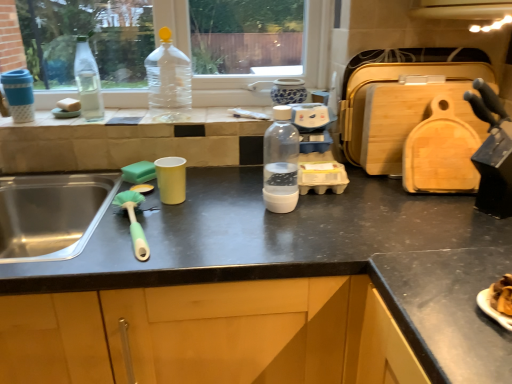
Question: Based on their sizes in the image, would you say green plastic brush at left is bigger or smaller than matte black countertop at center?

Choices:
 (A) big
 (B) small

Answer: (B)

Question: In terms of height, does green plastic brush at left look taller or shorter compared to matte black countertop at center?

Choices:
 (A) tall
 (B) short

Answer: (B)

Question: Considering the real-world distances, which object is farthest from the transparent plastic bottle at upper center, the second bottle when ordered from left to right?

Choices:
 (A) white sponge at left, positioned as the first food in left-to-right order
 (B) matte black countertop at center
 (C) transparent plastic bottle at center, arranged as the third bottle when viewed from the back
 (D) green sponge at left, arranged as the 2th food when viewed from the back
 (E) clear glass bottle at left, the 1th bottle from the back

Answer: (B)

Question: Which object is the closest to the translucent glass bottle at upper center?

Choices:
 (A) matte black countertop at center
 (B) green plastic brush at left
 (C) transparent plastic bottle at upper center, the second bottle when ordered from left to right
 (D) transparent plastic bottle at center, the first bottle from the right
 (E) green sponge at left, arranged as the 2th food when viewed from the back

Answer: (C)